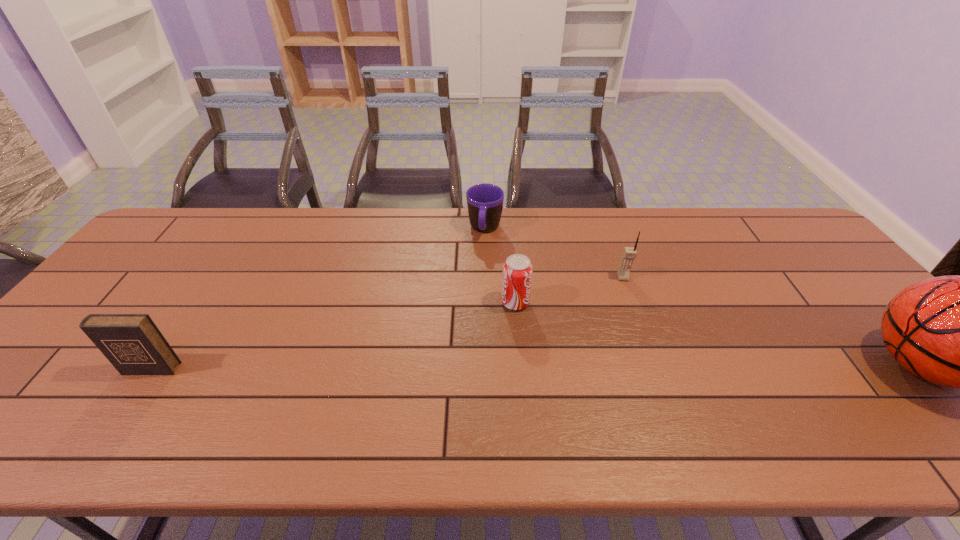
Where is `vacant space on the desktop that is between the leftmost object and the basketball and is positioned on the logo side of the soda can`? vacant space on the desktop that is between the leftmost object and the basketball and is positioned on the logo side of the soda can is located at coordinates (641, 367).

Find the location of a particular element. vacant spot on the desktop that is between the leftmost object and the rightmost object and is positioned with the handle on the side of the shortest object is located at coordinates (463, 368).

You are a GUI agent. You are given a task and a screenshot of the screen. Output one action in this format:
    pyautogui.click(x=<x>, y=<y>)
    Task: Click on the free spot on the desktop that is between the leftmost object and the rightmost object and is positioned on the front of the cellular telephone, where the keypad is located
    The image size is (960, 540).
    Given the screenshot: What is the action you would take?
    pyautogui.click(x=642, y=367)